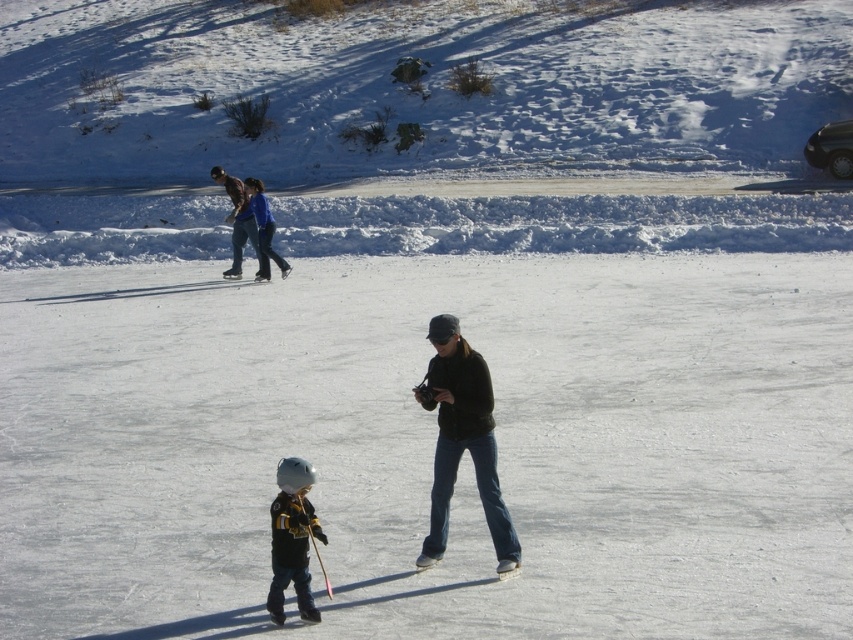
Who is shorter, black matte jacket at center or matte black helmet at center?

With less height is matte black helmet at center.

Between point (444, 410) and point (303, 483), which one is positioned in front?

Positioned in front is point (303, 483).

Identify the location of black matte jacket at center. (462, 440).

Is black matte jacket at center wider than white plastic ski at center?

Yes, black matte jacket at center is wider than white plastic ski at center.

Can you confirm if black matte jacket at center is smaller than white plastic ski at center?

Incorrect, black matte jacket at center is not smaller in size than white plastic ski at center.

I want to click on black matte jacket at center, so click(x=462, y=440).

Measure the distance between matte black helmet at center and white plastic ski at center.

They are 4.44 feet apart.

Between matte black helmet at center and white plastic ski at center, which one has more height?

Standing taller between the two is matte black helmet at center.

Identify the location of matte black helmet at center. (292, 538).